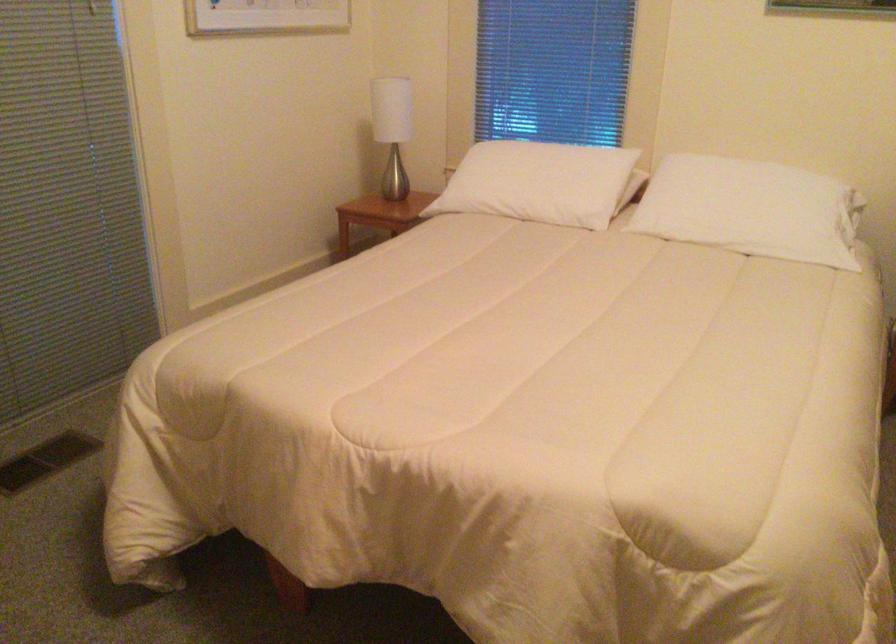
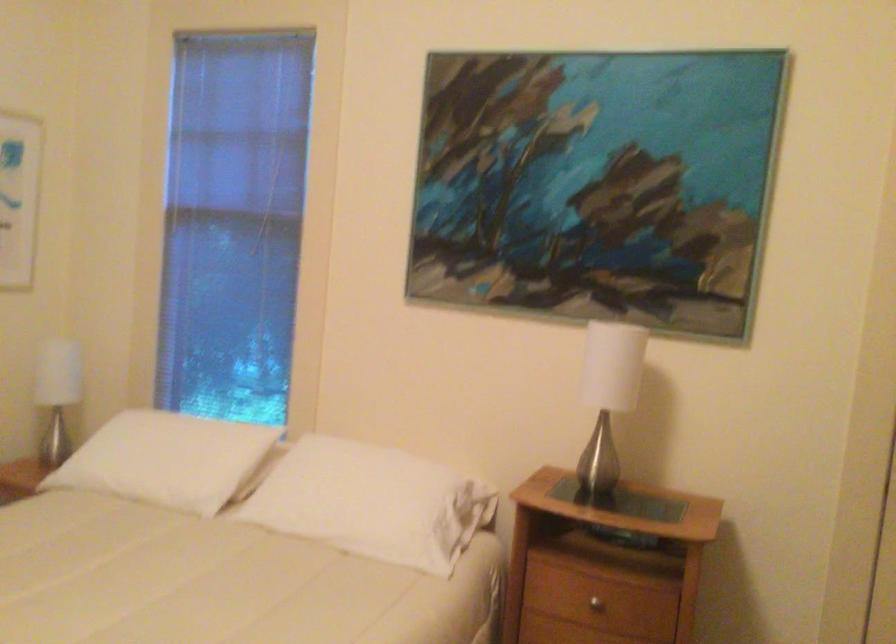
Question: What movement of the cameraman would produce the second image?

Choices:
 (A) Left
 (B) Right
 (C) Forward
 (D) Backward

Answer: (B)